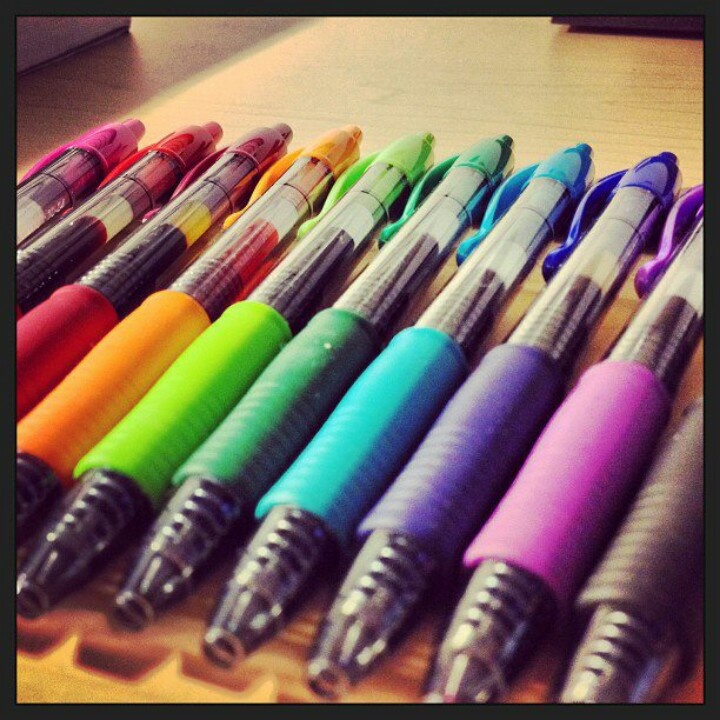
Locate an element on the screen. pens is located at coordinates (648, 531), (558, 504), (417, 469), (332, 459), (261, 436), (192, 418), (104, 405), (42, 360), (36, 261), (26, 212).